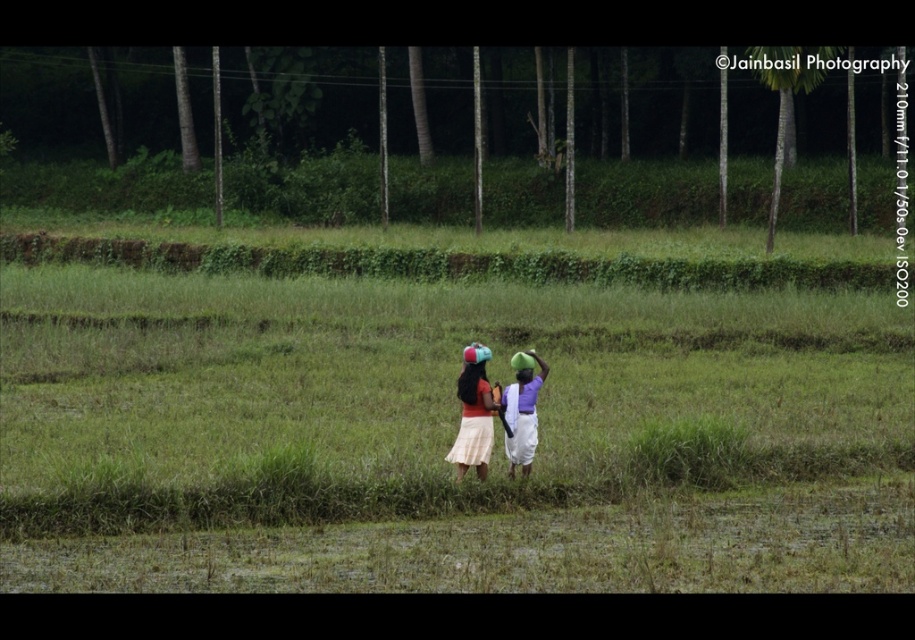
Question: Which point is closer to the camera taking this photo?

Choices:
 (A) 525,353
 (B) 467,449

Answer: (B)

Question: Is beige cotton dress at center positioned at the back of green matte headband at center?

Choices:
 (A) yes
 (B) no

Answer: (B)

Question: Estimate the real-world distances between objects in this image. Which object is closer to the green matte headband at center?

Choices:
 (A) matte fabric dress at center
 (B) matte green headscarf at center
 (C) beige cotton dress at center

Answer: (B)

Question: Is matte fabric dress at center to the right of matte green headscarf at center from the viewer's perspective?

Choices:
 (A) no
 (B) yes

Answer: (A)

Question: From the image, what is the correct spatial relationship of matte fabric dress at center in relation to matte green headscarf at center?

Choices:
 (A) below
 (B) above

Answer: (B)

Question: Which is farther from the matte green headscarf at center?

Choices:
 (A) beige cotton dress at center
 (B) matte fabric dress at center
 (C) green matte headband at center

Answer: (A)